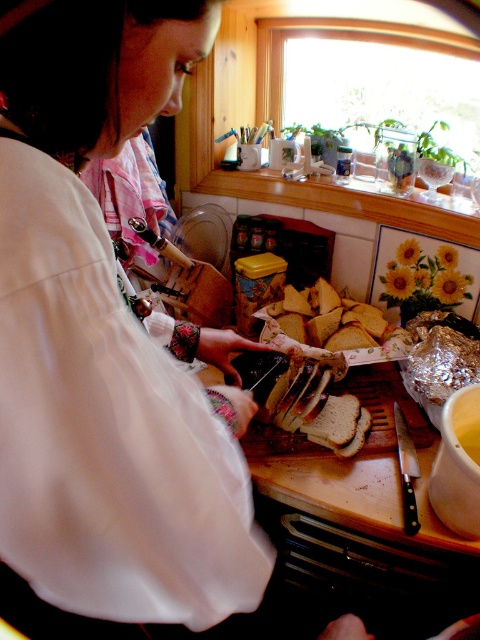
You are a delivery person who needs to place a small package on the counter without getting too close to the person preparing food. The package must be placed either on the white matte shirt at center or the wooden at center. Which location is farther away from the person?

The wooden at center is farther away from the white matte shirt at center by 17.05 inches, so placing the package on the wooden at center would be farther from the person.

You are a chef observing the scene. You need to reach for the wooden cutting board at center to continue preparing the sandwich. Which item, the white matte shirt at center or the wooden at center, will you encounter first as you move toward the cutting board?

The white matte shirt at center is closer to the viewer than wooden at center, so you will encounter the white matte shirt at center first when moving toward the cutting board.